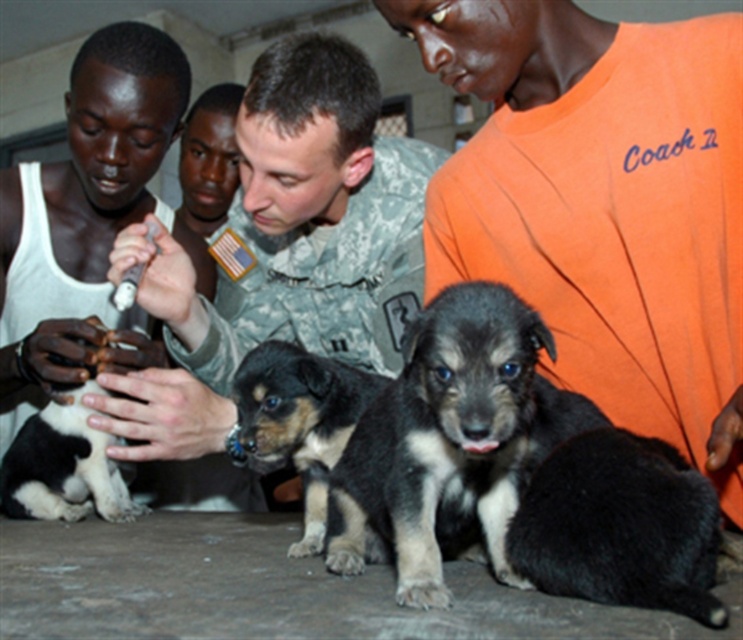
You are a photographer trying to capture a group photo of the orange cotton shirt at upper right and the camouflage uniform at center. Based on their positions, which one should you place on the left side of the photo to ensure they are aligned with their current arrangement?

The camouflage uniform at center is on the left side of the orange cotton shirt at upper right, so to maintain their current arrangement, you should place the camouflage uniform at center on the left side of the photo.

In the scene with the black fur puppy at center and the black and tan fur puppy at center, which puppy is taller?

The black fur puppy at center is taller than the black and tan fur puppy at center.

Looking at this image, where is the orange cotton shirt at upper right located in the image?

The orange cotton shirt at upper right is located at point (603, 204) in the image.